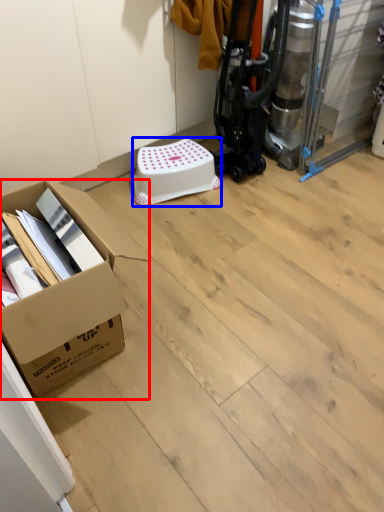
Question: Among these objects, which one is nearest to the camera, box (highlighted by a red box) or stool (highlighted by a blue box)?

Choices:
 (A) box
 (B) stool

Answer: (A)